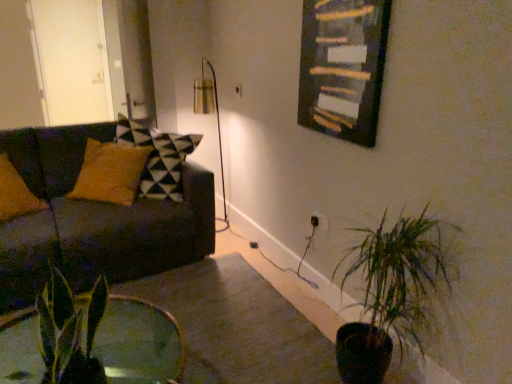
Identify the location of dark brown fabric couch at left. (94, 220).

Where is `green glossy leaf at lower left, marked as the 1th houseplant in a front-to-back arrangement`? green glossy leaf at lower left, marked as the 1th houseplant in a front-to-back arrangement is located at coordinates (70, 331).

Locate an element on the screen. This screenshot has width=512, height=384. white glossy door at upper left is located at coordinates (71, 60).

Measure the distance between point (x=320, y=49) and camera.

Point (x=320, y=49) is 2.20 meters from camera.

Find the location of a particular element. The image size is (512, 384). dark brown fabric couch at left is located at coordinates (94, 220).

At what (x,y) coordinates should I click in order to perform the action: click on glass door behind the metallic gold table lamp at center. Please return your answer as a coordinate pair (x, y). The width and height of the screenshot is (512, 384). Looking at the image, I should click on (71, 60).

From a real-world perspective, is metallic gold table lamp at center positioned over white glossy door at upper left based on gravity?

No, from a real-world perspective, metallic gold table lamp at center is not above white glossy door at upper left.

Would you say metallic gold table lamp at center is a long distance from white glossy door at upper left?

metallic gold table lamp at center is actually quite close to white glossy door at upper left.

Does point (213, 81) come closer to viewer compared to point (38, 37)?

No, (213, 81) is further to viewer.

Considering the sizes of white glossy door at upper left and green leafy plant at lower right, placed as the 2th houseplant when sorted from left to right, in the image, is white glossy door at upper left wider or thinner than green leafy plant at lower right, placed as the 2th houseplant when sorted from left to right,?

Clearly, white glossy door at upper left has less width compared to green leafy plant at lower right, placed as the 2th houseplant when sorted from left to right.

Between white glossy door at upper left and green leafy plant at lower right, arranged as the 1th houseplant when viewed from the right, which one is positioned in front?

Positioned in front is green leafy plant at lower right, arranged as the 1th houseplant when viewed from the right.

In the scene shown: Is white glossy door at upper left not close to green leafy plant at lower right, arranged as the 2th houseplant when viewed from the front?

Absolutely, white glossy door at upper left is distant from green leafy plant at lower right, arranged as the 2th houseplant when viewed from the front.

Is white glossy door at upper left looking in the opposite direction of green leafy plant at lower right, arranged as the 1th houseplant when viewed from the right?

No, white glossy door at upper left is not facing the opposite direction of green leafy plant at lower right, arranged as the 1th houseplant when viewed from the right.

Is the position of green leafy plant at lower right, arranged as the 1th houseplant when viewed from the right, less distant than that of white glossy door at upper left?

Yes, green leafy plant at lower right, arranged as the 1th houseplant when viewed from the right, is closer to the camera.

From the image's perspective, is green leafy plant at lower right, the 1th houseplant positioned from the back, located above white glossy door at upper left?

No, from the image's perspective, green leafy plant at lower right, the 1th houseplant positioned from the back, is not over white glossy door at upper left.

Does point (355, 367) appear closer or farther from the camera than point (75, 19)?

Point (355, 367) is positioned closer to the camera compared to point (75, 19).

Is green leafy plant at lower right, the 1th houseplant positioned from the back, aimed at white glossy door at upper left?

No, green leafy plant at lower right, the 1th houseplant positioned from the back, does not turn towards white glossy door at upper left.

From the image's perspective, which is below, green leafy plant at lower right, the 1th houseplant positioned from the back, or dark brown fabric couch at left?

green leafy plant at lower right, the 1th houseplant positioned from the back.

Could you tell me if green leafy plant at lower right, arranged as the 1th houseplant when viewed from the right, is turned towards dark brown fabric couch at left?

No.

Does green leafy plant at lower right, the 1th houseplant positioned from the back, appear on the left side of dark brown fabric couch at left?

No.

From the picture: Is green leafy plant at lower right, arranged as the 1th houseplant when viewed from the right, outside of dark brown fabric couch at left?

That's correct, green leafy plant at lower right, arranged as the 1th houseplant when viewed from the right, is outside of dark brown fabric couch at left.

From the image's perspective, is green leafy plant at lower right, arranged as the 1th houseplant when viewed from the right, over wooden frame at upper center?

Actually, green leafy plant at lower right, arranged as the 1th houseplant when viewed from the right, appears below wooden frame at upper center in the image.

Identify the location of picture frame behind the green leafy plant at lower right, placed as the 2th houseplant when sorted from left to right. Image resolution: width=512 pixels, height=384 pixels. (343, 67).

Between point (397, 287) and point (356, 14), which one is positioned in front?

The point (397, 287) is in front.

Relative to wooden frame at upper center, is green leafy plant at lower right, arranged as the 1th houseplant when viewed from the right, in front or behind?

green leafy plant at lower right, arranged as the 1th houseplant when viewed from the right, is in front of wooden frame at upper center.

Which is closer to the camera, (88,353) or (196,111)?

The point (88,353) is more forward.

Are green glossy leaf at lower left, positioned as the 2th houseplant in right-to-left order, and metallic gold table lamp at center beside each other?

There is a gap between green glossy leaf at lower left, positioned as the 2th houseplant in right-to-left order, and metallic gold table lamp at center.

Is metallic gold table lamp at center inside green glossy leaf at lower left, marked as the 1th houseplant in a front-to-back arrangement?

No, green glossy leaf at lower left, marked as the 1th houseplant in a front-to-back arrangement, does not contain metallic gold table lamp at center.

What's the angular difference between green glossy leaf at lower left, the 1th houseplant positioned from the left, and metallic gold table lamp at center's facing directions?

There is a 4.85-degree angle between the facing directions of green glossy leaf at lower left, the 1th houseplant positioned from the left, and metallic gold table lamp at center.

Does metallic gold table lamp at center have a greater width compared to wooden frame at upper center?

Indeed, metallic gold table lamp at center has a greater width compared to wooden frame at upper center.

From a real-world perspective, relative to wooden frame at upper center, is metallic gold table lamp at center vertically above or below?

metallic gold table lamp at center is situated lower than wooden frame at upper center in the real world.

Can you see metallic gold table lamp at center touching wooden frame at upper center?

There is a gap between metallic gold table lamp at center and wooden frame at upper center.

Is metallic gold table lamp at center oriented away from wooden frame at upper center?

No, wooden frame at upper center is not at the back of metallic gold table lamp at center.

At what (x,y) coordinates should I click in order to perform the action: click on glass door lying behind the metallic gold table lamp at center. Please return your answer as a coordinate pair (x, y). Looking at the image, I should click on (71, 60).

Locate an element on the screen. glass door located above the green leafy plant at lower right, placed as the 2th houseplant when sorted from left to right (from the image's perspective) is located at coordinates (71, 60).

When comparing their distances from dark brown fabric couch at left, does green glossy leaf at lower left, which appears as the 2th houseplant when viewed from the back, or green leafy plant at lower right, arranged as the 2th houseplant when viewed from the front, seem further?

green leafy plant at lower right, arranged as the 2th houseplant when viewed from the front, is positioned further to the anchor dark brown fabric couch at left.

Consider the image. Estimate the real-world distances between objects in this image. Which object is closer to dark brown fabric couch at left, white glossy door at upper left or wooden frame at upper center?

white glossy door at upper left.

Estimate the real-world distances between objects in this image. Which object is closer to metallic gold table lamp at center, dark brown fabric couch at left or white glossy door at upper left?

Among the two, white glossy door at upper left is located nearer to metallic gold table lamp at center.

Estimate the real-world distances between objects in this image. Which object is further from green leafy plant at lower right, arranged as the 1th houseplant when viewed from the right, wooden frame at upper center or green glossy leaf at lower left, positioned as the 2th houseplant in right-to-left order?

The object further to green leafy plant at lower right, arranged as the 1th houseplant when viewed from the right, is green glossy leaf at lower left, positioned as the 2th houseplant in right-to-left order.

Which object lies further to the anchor point metallic gold table lamp at center, dark brown fabric couch at left or wooden frame at upper center?

wooden frame at upper center is further to metallic gold table lamp at center.

Considering their positions, is metallic gold table lamp at center positioned closer to wooden frame at upper center than dark brown fabric couch at left?

dark brown fabric couch at left is positioned closer to the anchor wooden frame at upper center.

Based on their spatial positions, is white glossy door at upper left or dark brown fabric couch at left closer to green glossy leaf at lower left, the 1th houseplant positioned from the left?

dark brown fabric couch at left is positioned closer to the anchor green glossy leaf at lower left, the 1th houseplant positioned from the left.

Considering their positions, is wooden frame at upper center positioned closer to metallic gold table lamp at center than white glossy door at upper left?

Among the two, white glossy door at upper left is located nearer to metallic gold table lamp at center.

Locate an element on the screen. studio couch positioned between green leafy plant at lower right, arranged as the 2th houseplant when viewed from the front, and white glossy door at upper left from near to far is located at coordinates (94, 220).

Find the location of `studio couch between wooden frame at upper center and white glossy door at upper left from front to back`. studio couch between wooden frame at upper center and white glossy door at upper left from front to back is located at coordinates (94, 220).

Where is `picture frame situated between dark brown fabric couch at left and green leafy plant at lower right, arranged as the 2th houseplant when viewed from the front, from left to right`? The height and width of the screenshot is (384, 512). picture frame situated between dark brown fabric couch at left and green leafy plant at lower right, arranged as the 2th houseplant when viewed from the front, from left to right is located at coordinates (343, 67).

You are a GUI agent. You are given a task and a screenshot of the screen. Output one action in this format:
    pyautogui.click(x=<x>, y=<y>)
    Task: Click on the table lamp between dark brown fabric couch at left and wooden frame at upper center from left to right
    
    Given the screenshot: What is the action you would take?
    pyautogui.click(x=207, y=114)